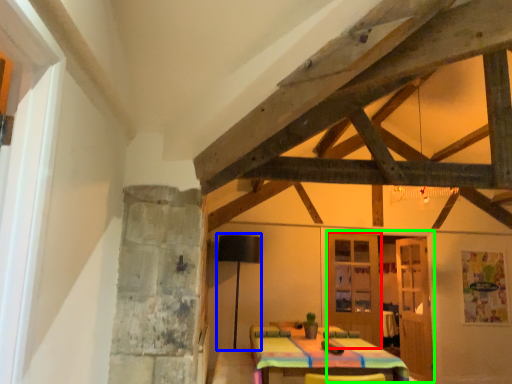
Question: Based on their relative distances, which object is farther from door (highlighted by a red box)? Choose from lamp (highlighted by a blue box) and door (highlighted by a green box).

Choices:
 (A) lamp
 (B) door

Answer: (A)